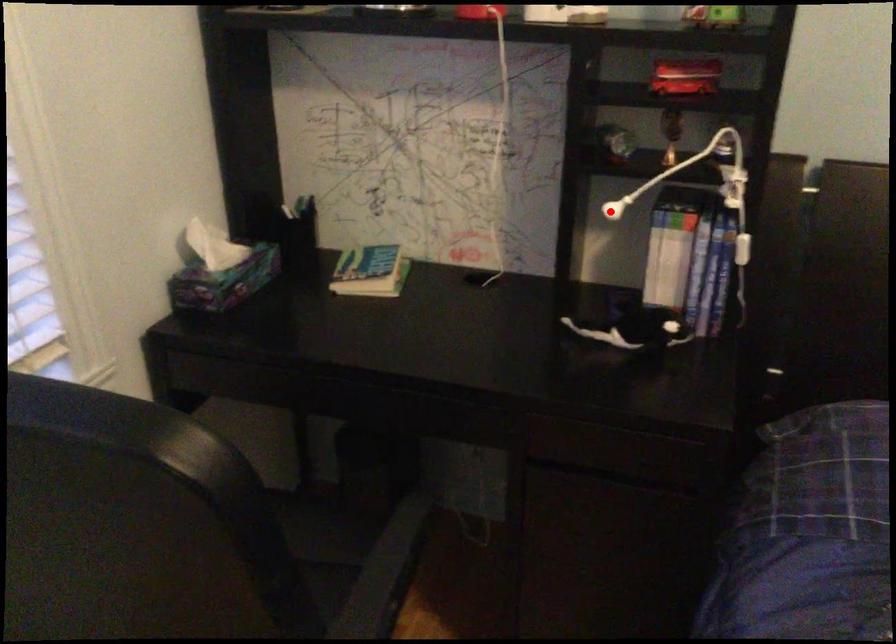
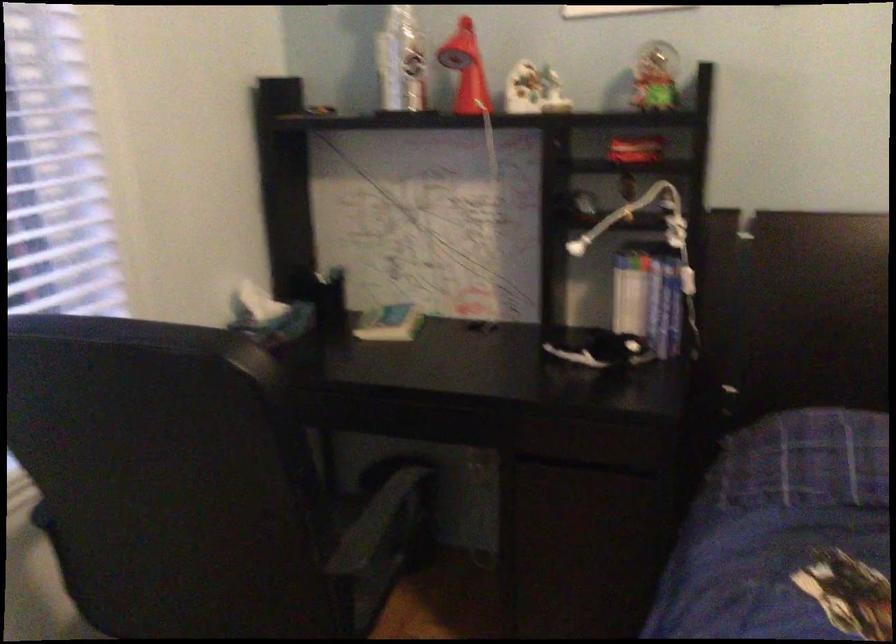
Question: I am providing you with two images of the same scene from different viewpoints. A red point is shown in image1. For the corresponding object point in image2, is it positioned nearer or farther from the camera?

Choices:
 (A) Nearer
 (B) Farther

Answer: (B)